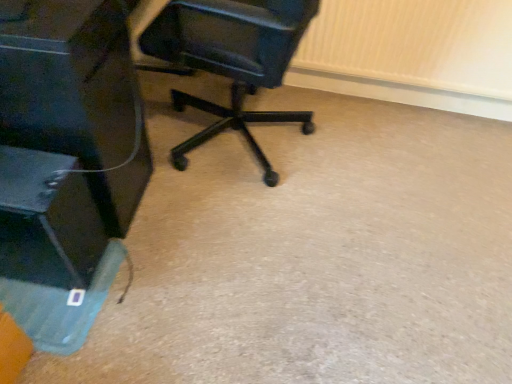
Question: Is black plastic chair at center to the right of matte black monitor at left from the viewer's perspective?

Choices:
 (A) no
 (B) yes

Answer: (B)

Question: From a real-world perspective, is black plastic chair at center on top of matte black monitor at left?

Choices:
 (A) no
 (B) yes

Answer: (B)

Question: Can matte black monitor at left be found inside black plastic chair at center?

Choices:
 (A) yes
 (B) no

Answer: (B)

Question: From the image's perspective, is black plastic chair at center below matte black monitor at left?

Choices:
 (A) no
 (B) yes

Answer: (A)

Question: Is black plastic chair at center taller than matte black monitor at left?

Choices:
 (A) yes
 (B) no

Answer: (A)

Question: Is the depth of black plastic chair at center less than that of matte black monitor at left?

Choices:
 (A) no
 (B) yes

Answer: (A)

Question: Considering the relative sizes of matte black monitor at left and black plastic chair at center in the image provided, is matte black monitor at left bigger than black plastic chair at center?

Choices:
 (A) yes
 (B) no

Answer: (A)

Question: Is matte black monitor at left positioned with its back to black plastic chair at center?

Choices:
 (A) yes
 (B) no

Answer: (A)

Question: From the image's perspective, is matte black monitor at left over black plastic chair at center?

Choices:
 (A) yes
 (B) no

Answer: (B)

Question: From the image's perspective, is matte black monitor at left beneath black plastic chair at center?

Choices:
 (A) yes
 (B) no

Answer: (A)

Question: Are matte black monitor at left and black plastic chair at center beside each other?

Choices:
 (A) no
 (B) yes

Answer: (A)

Question: Considering the relative sizes of matte black monitor at left and black plastic chair at center in the image provided, is matte black monitor at left shorter than black plastic chair at center?

Choices:
 (A) no
 (B) yes

Answer: (B)

Question: Is black plastic chair at center inside the boundaries of matte black monitor at left, or outside?

Choices:
 (A) outside
 (B) inside

Answer: (A)